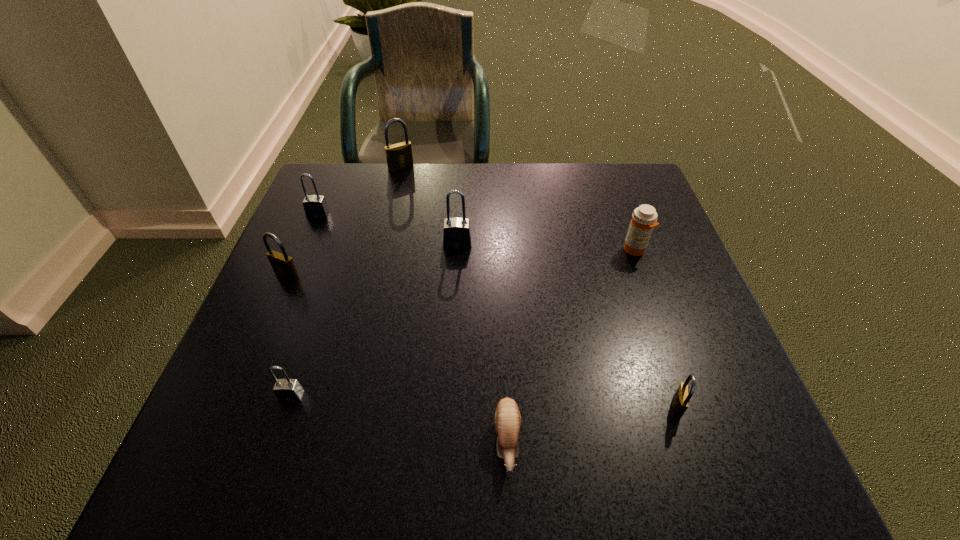
Locate an element on the screen. The height and width of the screenshot is (540, 960). the second gray padlock from right to left is located at coordinates (288, 390).

In order to click on the rightmost padlock in this screenshot , I will do `click(680, 402)`.

Find the location of a particular element. the rightmost brass padlock is located at coordinates (680, 402).

Find the location of a particular element. The width and height of the screenshot is (960, 540). escargot is located at coordinates (507, 417).

Identify the location of the shortest object. This screenshot has height=540, width=960. (507, 417).

Where is `vacant space positioned on the front of the fifth object from right to left`? vacant space positioned on the front of the fifth object from right to left is located at coordinates (389, 222).

Find the location of `vacant region located 0.180m on the shackle of the second nearest gray padlock`. vacant region located 0.180m on the shackle of the second nearest gray padlock is located at coordinates (454, 309).

In order to click on vacant point located 0.240m on the shackle of the seventh nearest object in this screenshot , I will do `click(287, 289)`.

What are the coordinates of `vacant region located on the back of the second nearest brass padlock` in the screenshot? It's located at (311, 219).

The image size is (960, 540). In order to click on vacant space located 0.080m on the back of the medicine in this screenshot , I will do `click(624, 220)`.